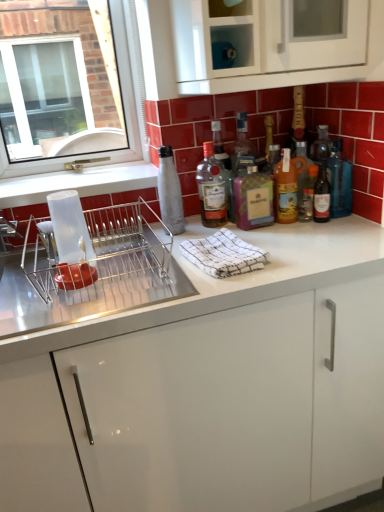
This screenshot has width=384, height=512. I want to click on free location to the left of matte glass wine bottle at center-right, so click(279, 231).